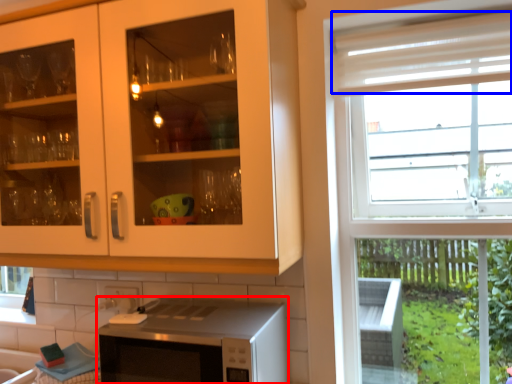
Question: Among these objects, which one is nearest to the camera, microwave oven (highlighted by a red box) or curtain (highlighted by a blue box)?

Choices:
 (A) microwave oven
 (B) curtain

Answer: (A)